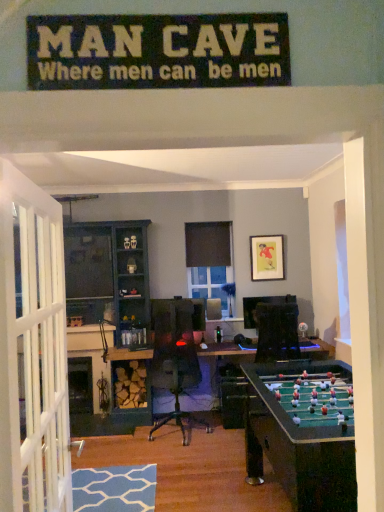
The height and width of the screenshot is (512, 384). What are the coordinates of `teal wood entertainment center at left` in the screenshot? It's located at (107, 280).

In order to face teal wood entertainment center at left, should I rotate leftwards or rightwards?

Turn left by 11.679 degrees to look at teal wood entertainment center at left.

Describe the element at coordinates (107, 280) in the screenshot. I see `teal wood entertainment center at left` at that location.

Locate an element on the screen. Image resolution: width=384 pixels, height=512 pixels. matte black picture frame at upper center is located at coordinates (267, 257).

The width and height of the screenshot is (384, 512). What do you see at coordinates (267, 257) in the screenshot? I see `matte black picture frame at upper center` at bounding box center [267, 257].

Measure the distance between point (257, 246) and camera.

Point (257, 246) is 5.02 meters away from camera.

Measure the distance between matte black picture frame at upper center and camera.

matte black picture frame at upper center is 4.96 meters away from camera.

Locate an element on the screen. teal wood entertainment center at left is located at coordinates (107, 280).

Between matte black picture frame at upper center and teal wood entertainment center at left, which one appears on the left side from the viewer's perspective?

Positioned to the left is teal wood entertainment center at left.

Considering their positions, is matte black picture frame at upper center located in front of or behind teal wood entertainment center at left?

matte black picture frame at upper center is positioned farther from the viewer than teal wood entertainment center at left.

Considering the positions of points (258, 278) and (107, 327), is point (258, 278) farther from camera compared to point (107, 327)?

That is True.

From the image's perspective, between matte black picture frame at upper center and teal wood entertainment center at left, who is located below?

teal wood entertainment center at left.

From a real-world perspective, is matte black picture frame at upper center under teal wood entertainment center at left?

No.

Considering the sizes of objects matte black picture frame at upper center and teal wood entertainment center at left in the image provided, who is thinner, matte black picture frame at upper center or teal wood entertainment center at left?

With smaller width is matte black picture frame at upper center.

Does matte black picture frame at upper center have a lesser height compared to teal wood entertainment center at left?

Correct, matte black picture frame at upper center is not as tall as teal wood entertainment center at left.

In terms of size, does matte black picture frame at upper center appear bigger or smaller than teal wood entertainment center at left?

Clearly, matte black picture frame at upper center is smaller in size than teal wood entertainment center at left.

Would you say matte black picture frame at upper center contains teal wood entertainment center at left?

No, teal wood entertainment center at left is located outside of matte black picture frame at upper center.

Is matte black picture frame at upper center not near teal wood entertainment center at left?

Yes, matte black picture frame at upper center and teal wood entertainment center at left are quite far apart.

Is matte black picture frame at upper center looking in the opposite direction of teal wood entertainment center at left?

matte black picture frame at upper center is not turned away from teal wood entertainment center at left.

Measure the distance between matte black picture frame at upper center and teal wood entertainment center at left.

matte black picture frame at upper center and teal wood entertainment center at left are 1.73 meters apart.

The height and width of the screenshot is (512, 384). In order to click on entertainment center in front of the matte black picture frame at upper center in this screenshot , I will do `click(107, 280)`.

Consider the image. Is teal wood entertainment center at left to the right of matte black picture frame at upper center from the viewer's perspective?

No.

In the image, is teal wood entertainment center at left positioned in front of or behind matte black picture frame at upper center?

Clearly, teal wood entertainment center at left is in front of matte black picture frame at upper center.

Considering the positions of point (146, 419) and point (271, 263), is point (146, 419) closer or farther from the camera than point (271, 263)?

Point (146, 419) is closer to the camera than point (271, 263).

From the image's perspective, is teal wood entertainment center at left located above or below matte black picture frame at upper center?

teal wood entertainment center at left is situated lower than matte black picture frame at upper center in the image.

From a real-world perspective, is teal wood entertainment center at left above or below matte black picture frame at upper center?

Clearly, from a real-world perspective, teal wood entertainment center at left is below matte black picture frame at upper center.

Is teal wood entertainment center at left thinner than matte black picture frame at upper center?

In fact, teal wood entertainment center at left might be wider than matte black picture frame at upper center.

Can you confirm if teal wood entertainment center at left is shorter than matte black picture frame at upper center?

In fact, teal wood entertainment center at left may be taller than matte black picture frame at upper center.

Who is bigger, teal wood entertainment center at left or matte black picture frame at upper center?

teal wood entertainment center at left.

Do you think teal wood entertainment center at left is within matte black picture frame at upper center, or outside of it?

teal wood entertainment center at left lies outside matte black picture frame at upper center.

Is teal wood entertainment center at left next to matte black picture frame at upper center and touching it?

No, teal wood entertainment center at left is not with matte black picture frame at upper center.

Is teal wood entertainment center at left looking in the opposite direction of matte black picture frame at upper center?

No, teal wood entertainment center at left's orientation is not away from matte black picture frame at upper center.

This screenshot has height=512, width=384. Find the location of `entertainment center that appears in front of the matte black picture frame at upper center`. entertainment center that appears in front of the matte black picture frame at upper center is located at coordinates (107, 280).

In order to click on picture frame above the teal wood entertainment center at left (from the image's perspective) in this screenshot , I will do `click(267, 257)`.

Locate an element on the screen. The height and width of the screenshot is (512, 384). picture frame to the right of teal wood entertainment center at left is located at coordinates (267, 257).